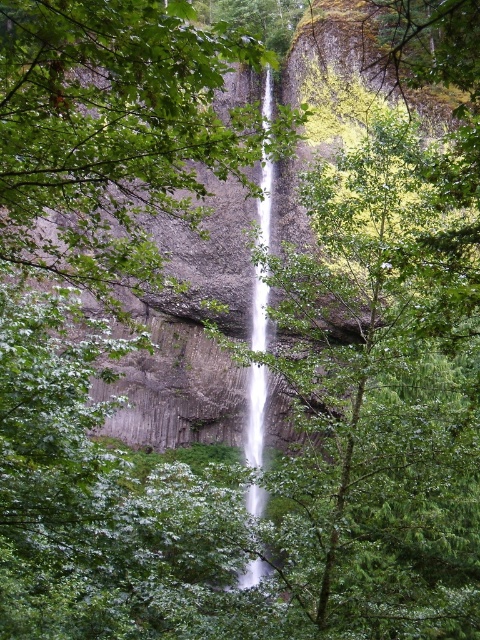
Question: Does green leafy tree at center appear on the left side of white smooth waterfall at center?

Choices:
 (A) no
 (B) yes

Answer: (B)

Question: Which point is closer to the camera taking this photo?

Choices:
 (A) (48, 241)
 (B) (266, 333)

Answer: (A)

Question: Which of the following is the closest to the observer?

Choices:
 (A) green leafy tree at center
 (B) white smooth waterfall at center

Answer: (A)

Question: Can you confirm if green leafy tree at center is thinner than white smooth waterfall at center?

Choices:
 (A) no
 (B) yes

Answer: (A)

Question: Can you confirm if green leafy tree at center is thinner than white smooth waterfall at center?

Choices:
 (A) yes
 (B) no

Answer: (B)